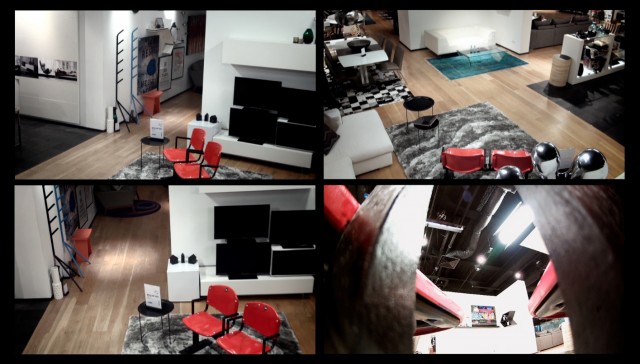
You are a GUI agent. You are given a task and a screenshot of the screen. Output one action in this format:
    pyautogui.click(x=<x>, y=<y>)
    Task: Click on the back rest of red chair
    
    Given the screenshot: What is the action you would take?
    pyautogui.click(x=259, y=324)